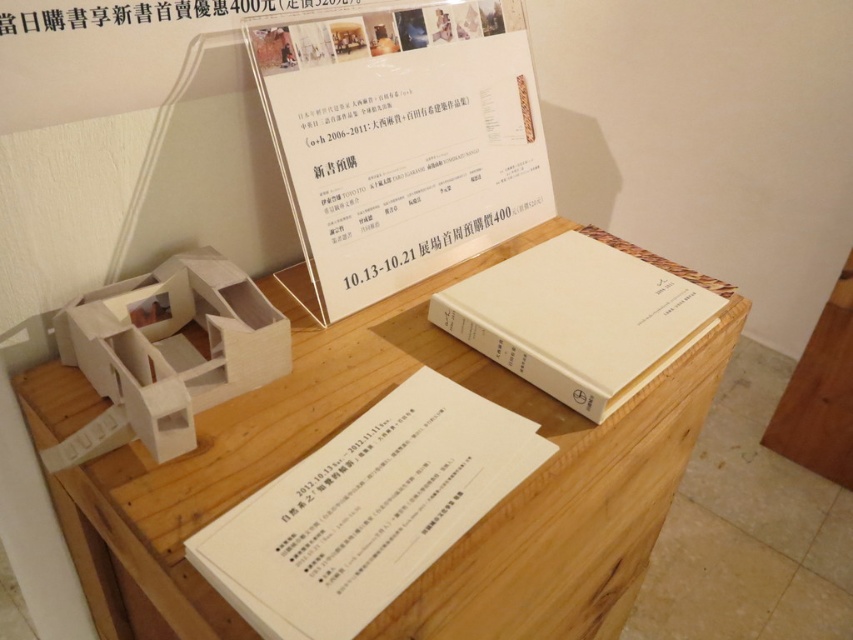
Can you confirm if wooden table at center is positioned below white cardboard model at center?

Yes.

Can you confirm if wooden table at center is shorter than white cardboard model at center?

In fact, wooden table at center may be taller than white cardboard model at center.

Describe the element at coordinates (466, 532) in the screenshot. The height and width of the screenshot is (640, 853). I see `wooden table at center` at that location.

Locate an element on the screen. wooden table at center is located at coordinates (466, 532).

Between white cardboard model at center and white matte book at center, which one has more height?

With more height is white matte book at center.

Can you confirm if white cardboard model at center is taller than white matte book at center?

No, white cardboard model at center is not taller than white matte book at center.

Is point (144, 369) less distant than point (561, 332)?

Yes, it is.

Identify the location of white cardboard model at center. (167, 353).

Is wooden table at center thinner than white matte book at center?

No, wooden table at center is not thinner than white matte book at center.

At what (x,y) coordinates should I click in order to perform the action: click on wooden table at center. Please return your answer as a coordinate pair (x, y). This screenshot has height=640, width=853. Looking at the image, I should click on (466, 532).

Find the location of a particular element. Image resolution: width=853 pixels, height=640 pixels. wooden table at center is located at coordinates coord(466,532).